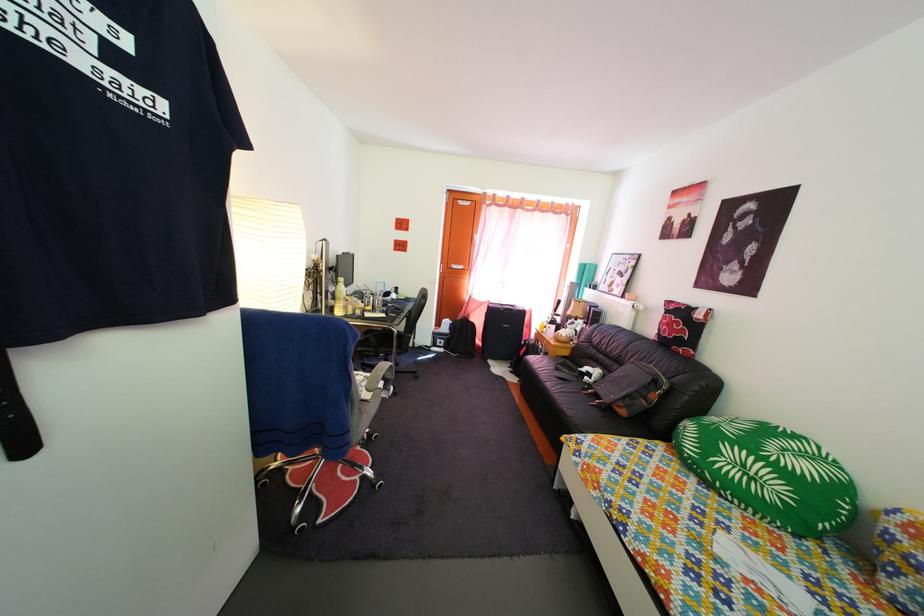
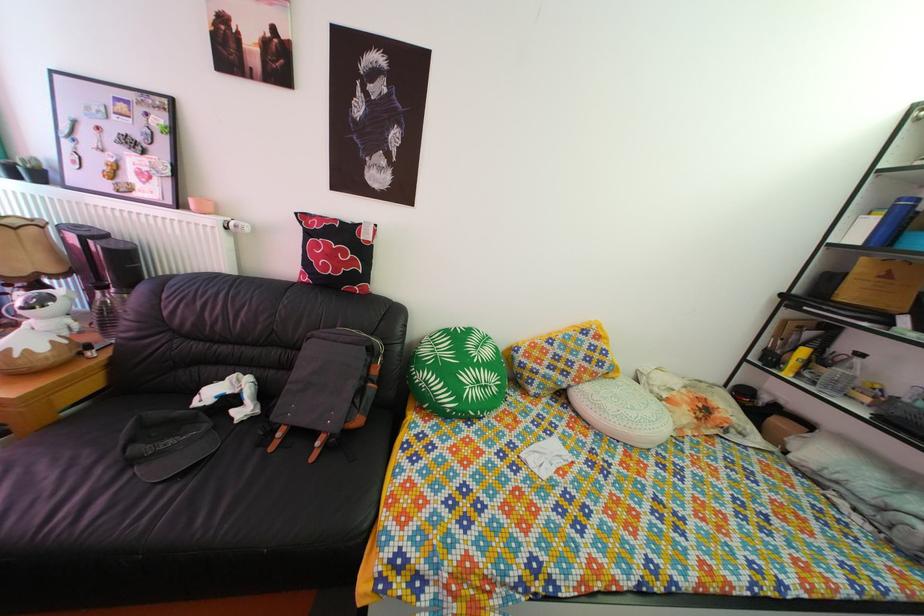
Find the pixel in the second image that matches point 678,333 in the first image.

(338, 264)